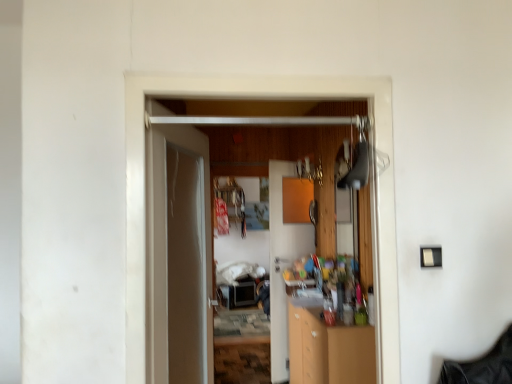
Question: Is wooden door at center, marked as the 3th door in a back-to-front arrangement, facing away from white glossy door at center, which ranks as the second door in back-to-front order?

Choices:
 (A) no
 (B) yes

Answer: (B)

Question: Is wooden door at center, arranged as the 1th door when viewed from the front, taller than white glossy door at center, the second door in the front-to-back sequence?

Choices:
 (A) no
 (B) yes

Answer: (A)

Question: Is wooden door at center, arranged as the 1th door when viewed from the front, aimed at white glossy door at center, which ranks as the second door in back-to-front order?

Choices:
 (A) yes
 (B) no

Answer: (B)

Question: Is wooden door at center, arranged as the 1th door when viewed from the front, shorter than white glossy door at center, the second door in the front-to-back sequence?

Choices:
 (A) yes
 (B) no

Answer: (A)

Question: Is wooden door at center, arranged as the 1th door when viewed from the front, in front of white glossy door at center, which ranks as the second door in back-to-front order?

Choices:
 (A) no
 (B) yes

Answer: (B)

Question: Is point (164, 241) closer or farther from the camera than point (269, 162)?

Choices:
 (A) closer
 (B) farther

Answer: (A)

Question: From a real-world perspective, relative to wooden cabinet at center, which appears as the first door when viewed from the back, is white glossy door at center, which ranks as the second door in back-to-front order, vertically above or below?

Choices:
 (A) above
 (B) below

Answer: (A)

Question: Considering the relative positions of white glossy door at center, which ranks as the second door in back-to-front order, and wooden cabinet at center, the 3th door from the front, in the image provided, is white glossy door at center, which ranks as the second door in back-to-front order, to the left or to the right of wooden cabinet at center, the 3th door from the front,?

Choices:
 (A) left
 (B) right

Answer: (A)

Question: From the image's perspective, is white glossy door at center, which ranks as the second door in back-to-front order, above or below wooden cabinet at center, the 3th door from the front?

Choices:
 (A) below
 (B) above

Answer: (B)

Question: Considering their positions, is wooden cabinet at center located in front of or behind wooden cabinet at center, which appears as the first door when viewed from the back?

Choices:
 (A) behind
 (B) front

Answer: (B)

Question: Would you say wooden cabinet at center is inside or outside wooden cabinet at center, which appears as the first door when viewed from the back?

Choices:
 (A) outside
 (B) inside

Answer: (A)

Question: In terms of height, does wooden cabinet at center look taller or shorter compared to wooden cabinet at center, the 3th door from the front?

Choices:
 (A) tall
 (B) short

Answer: (B)

Question: Is point (321, 327) positioned closer to the camera than point (269, 165)?

Choices:
 (A) closer
 (B) farther

Answer: (A)

Question: Looking at their shapes, would you say wooden door at center, marked as the 3th door in a back-to-front arrangement, is wider or thinner than wooden cabinet at center, which appears as the first door when viewed from the back?

Choices:
 (A) thin
 (B) wide

Answer: (A)

Question: Is wooden door at center, arranged as the 1th door when viewed from the front, in front of or behind wooden cabinet at center, the 3th door from the front, in the image?

Choices:
 (A) front
 (B) behind

Answer: (A)